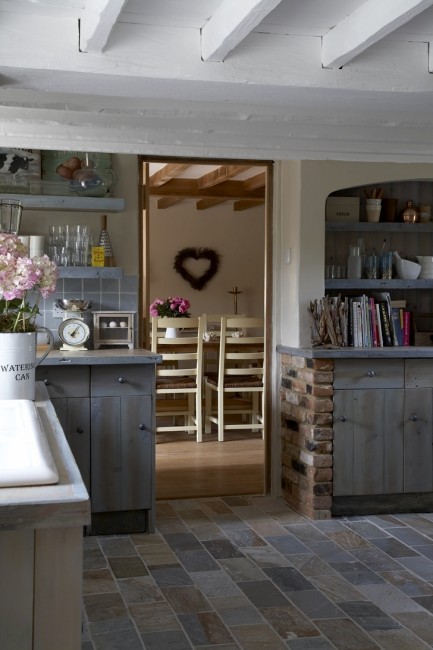
Identify the location of wood floor. This screenshot has width=433, height=650. (225, 478).